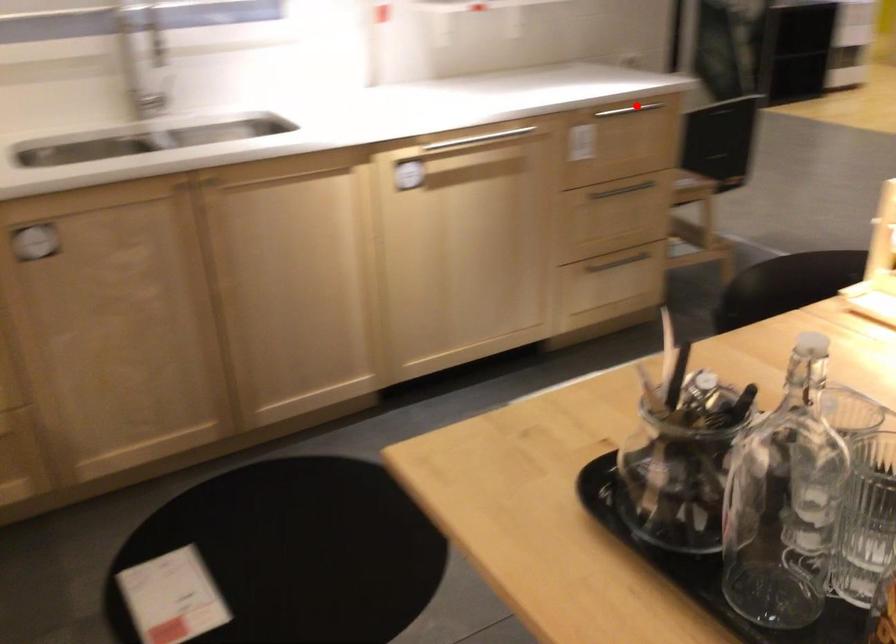
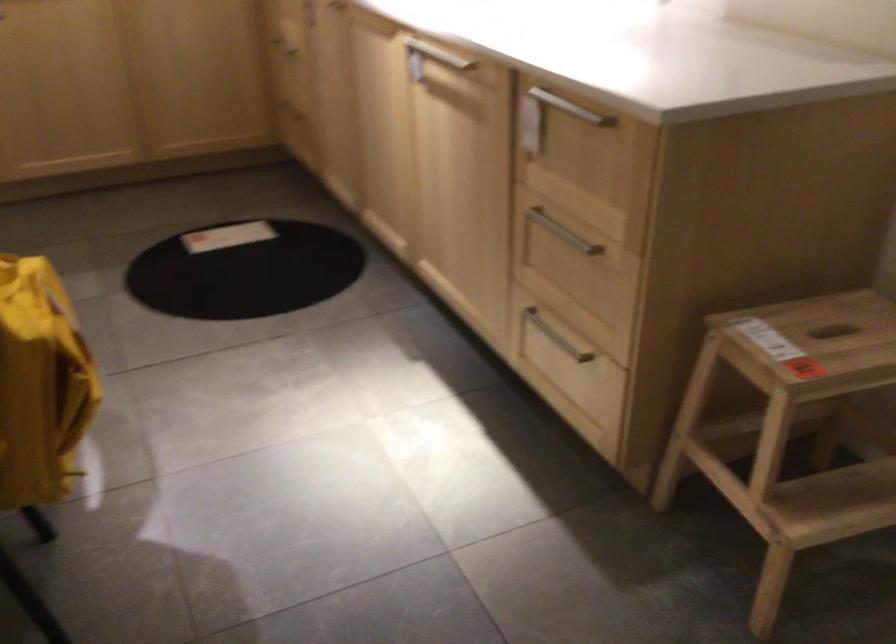
The point at the highlighted location is marked in the first image. Where is the corresponding point in the second image?

(570, 108)